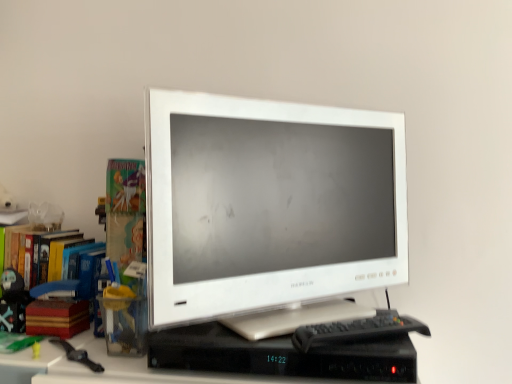
Question: From the image's perspective, is wooden stack of books at left positioned above or below white glossy monitor at center?

Choices:
 (A) below
 (B) above

Answer: (A)

Question: In terms of size, does wooden stack of books at left appear bigger or smaller than white glossy monitor at center?

Choices:
 (A) big
 (B) small

Answer: (B)

Question: Which object is the closest to the black plastic keyboard at center?

Choices:
 (A) multicolored cardboard books at left
 (B) white glossy monitor at center
 (C) wooden stack of books at left
 (D) matte black figurine at left
 (E) black plastic computer desk at center

Answer: (E)

Question: Which object is positioned farthest from the black plastic keyboard at center?

Choices:
 (A) matte black figurine at left
 (B) multicolored cardboard books at left
 (C) white glossy monitor at center
 (D) black plastic computer desk at center
 (E) wooden stack of books at left

Answer: (A)